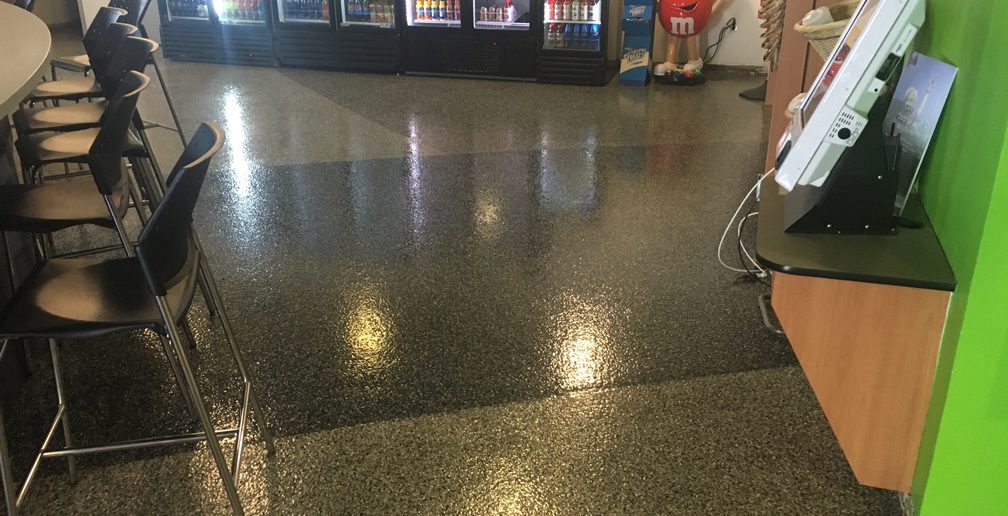
Where is `white wall`? The image size is (1008, 516). white wall is located at coordinates (742, 35).